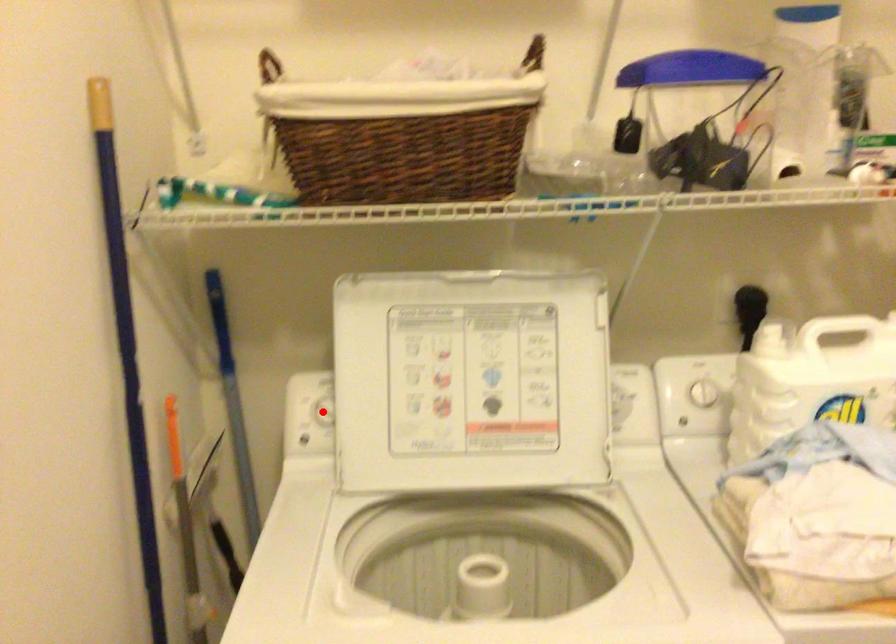
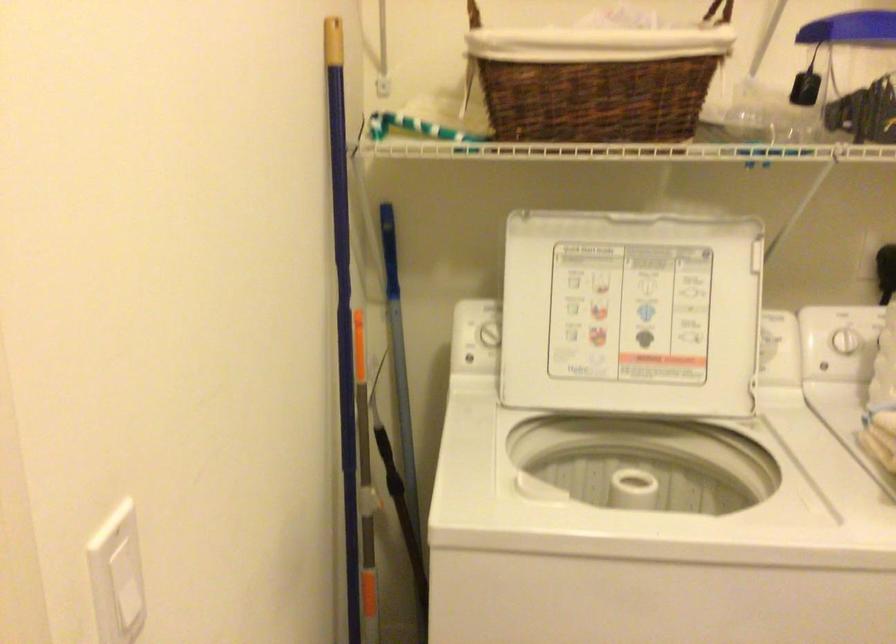
Question: A red point is marked in image1. In image2, is the corresponding 3D point closer to the camera or farther? Reply with the corresponding letter.

Choices:
 (A) The corresponding 3D point is closer.
 (B) The corresponding 3D point is farther.

Answer: (B)